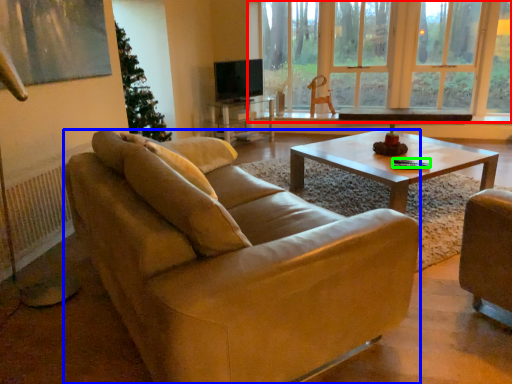
Question: Estimate the real-world distances between objects in this image. Which object is closer to window (highlighted by a red box), studio couch (highlighted by a blue box) or corded phone (highlighted by a green box)?

Choices:
 (A) studio couch
 (B) corded phone

Answer: (B)